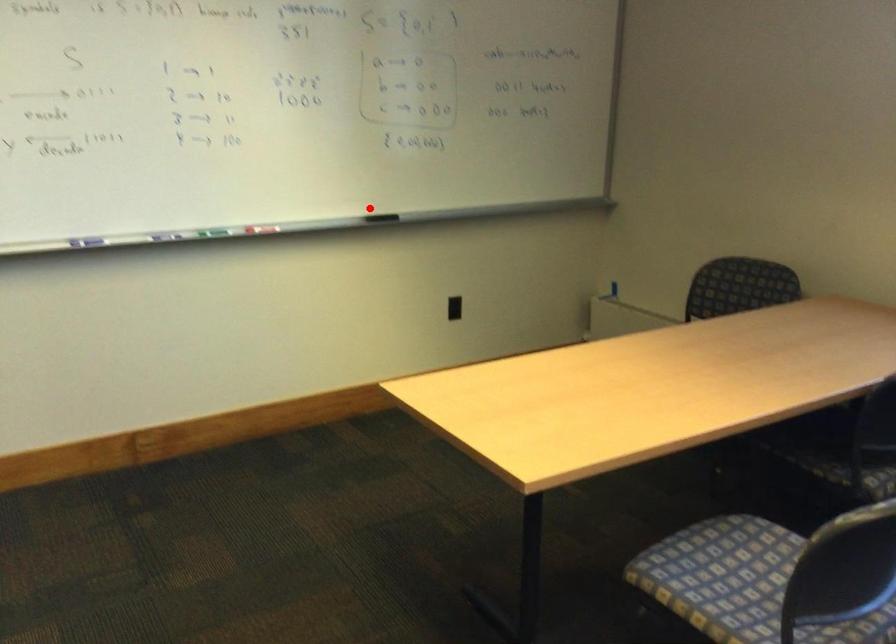
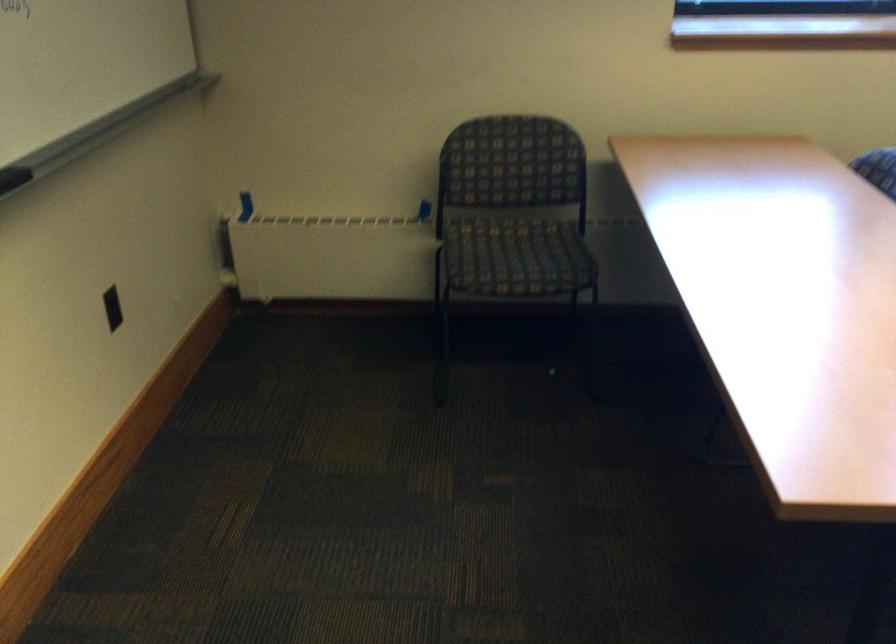
Locate, in the second image, the point that corresponds to the highlighted location in the first image.

(13, 178)